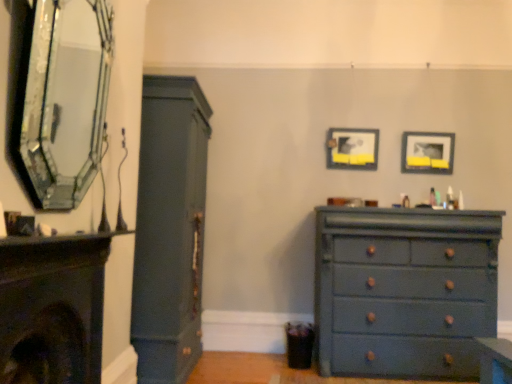
Question: Is matte dark green cabinet at left inside the boundaries of matte dark blue fireplace at left, which appears as the 1th fireplace when ordered from the bottom, or outside?

Choices:
 (A) inside
 (B) outside

Answer: (B)

Question: From a real-world perspective, is matte dark green cabinet at left physically located above or below matte dark blue fireplace at left, acting as the 2th fireplace starting from the top?

Choices:
 (A) above
 (B) below

Answer: (A)

Question: Considering the real-world distances, which object is farthest from the matte black fireplace at left, which is the 1th fireplace in top-to-bottom order?

Choices:
 (A) matte black picture frame at upper right, the 2th picture frame positioned from the left
 (B) matte dark blue fireplace at left, which appears as the 1th fireplace when ordered from the bottom
 (C) matte black picture frame at upper center, arranged as the second picture frame when viewed from the right
 (D) matte blue dresser at lower right
 (E) matte dark green cabinet at left

Answer: (A)

Question: Which object is the farthest from the matte dark green cabinet at left?

Choices:
 (A) matte dark blue fireplace at left, acting as the 2th fireplace starting from the top
 (B) matte blue dresser at lower right
 (C) matte black picture frame at upper center, arranged as the second picture frame when viewed from the right
 (D) matte black picture frame at upper right, the 2th picture frame positioned from the left
 (E) matte black fireplace at left, which is the 1th fireplace in top-to-bottom order

Answer: (D)